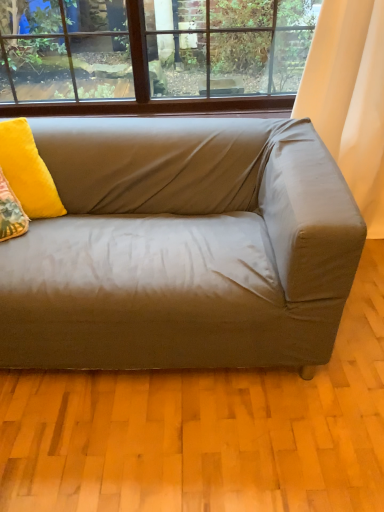
Question: From the image's perspective, does white fabric curtain at right appear higher than satin beige couch at center?

Choices:
 (A) yes
 (B) no

Answer: (A)

Question: Can you confirm if white fabric curtain at right is bigger than satin beige couch at center?

Choices:
 (A) yes
 (B) no

Answer: (B)

Question: Considering the relative positions of white fabric curtain at right and satin beige couch at center in the image provided, is white fabric curtain at right to the left of satin beige couch at center from the viewer's perspective?

Choices:
 (A) no
 (B) yes

Answer: (A)

Question: Is the depth of white fabric curtain at right less than that of satin beige couch at center?

Choices:
 (A) yes
 (B) no

Answer: (B)

Question: Can you confirm if white fabric curtain at right is thinner than satin beige couch at center?

Choices:
 (A) no
 (B) yes

Answer: (B)

Question: Considering the relative sizes of white fabric curtain at right and satin beige couch at center in the image provided, is white fabric curtain at right shorter than satin beige couch at center?

Choices:
 (A) yes
 (B) no

Answer: (B)

Question: Can you confirm if satin beige couch at center is taller than white fabric curtain at right?

Choices:
 (A) yes
 (B) no

Answer: (B)

Question: Is satin beige couch at center turned away from white fabric curtain at right?

Choices:
 (A) no
 (B) yes

Answer: (A)

Question: Is satin beige couch at center positioned beyond the bounds of white fabric curtain at right?

Choices:
 (A) yes
 (B) no

Answer: (A)

Question: Is satin beige couch at center at the left side of white fabric curtain at right?

Choices:
 (A) yes
 (B) no

Answer: (A)

Question: Is satin beige couch at center shorter than white fabric curtain at right?

Choices:
 (A) yes
 (B) no

Answer: (A)

Question: From the image's perspective, is satin beige couch at center above white fabric curtain at right?

Choices:
 (A) no
 (B) yes

Answer: (A)

Question: Is satin beige couch at center oriented towards velvet yellow pillow at upper left?

Choices:
 (A) yes
 (B) no

Answer: (B)